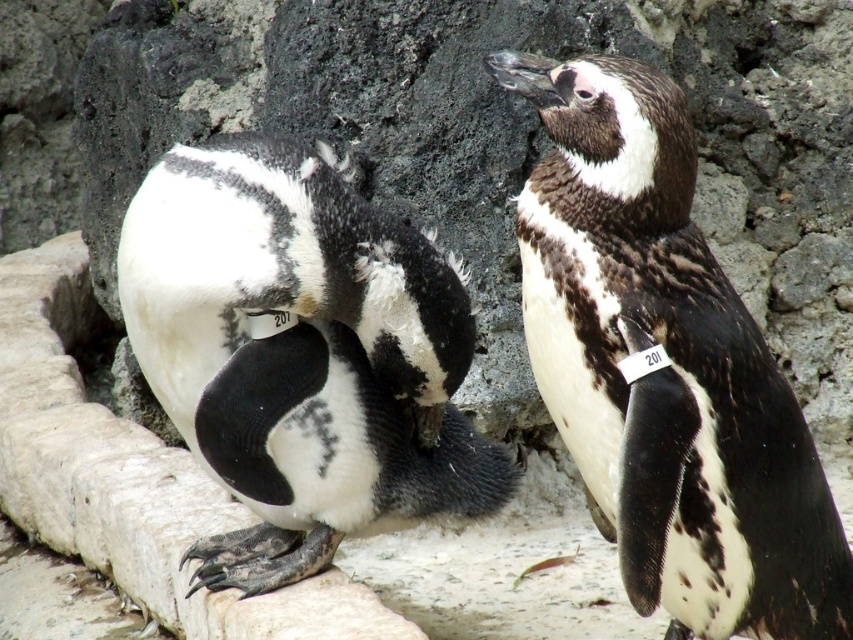
Question: Is black and white feathers at center thinner than white matte penguin at center?

Choices:
 (A) no
 (B) yes

Answer: (B)

Question: Is black and white feathers at center to the right of white matte penguin at center from the viewer's perspective?

Choices:
 (A) no
 (B) yes

Answer: (B)

Question: Which point is closer to the camera?

Choices:
 (A) (192, 410)
 (B) (567, 220)

Answer: (B)

Question: Considering the relative positions of black and white feathers at center and white matte penguin at center in the image provided, where is black and white feathers at center located with respect to white matte penguin at center?

Choices:
 (A) right
 (B) left

Answer: (A)